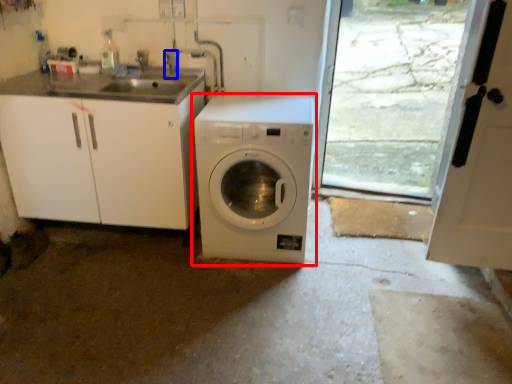
Question: Which object appears farthest to the camera in this image, washing machine (highlighted by a red box) or faucet (highlighted by a blue box)?

Choices:
 (A) washing machine
 (B) faucet

Answer: (B)